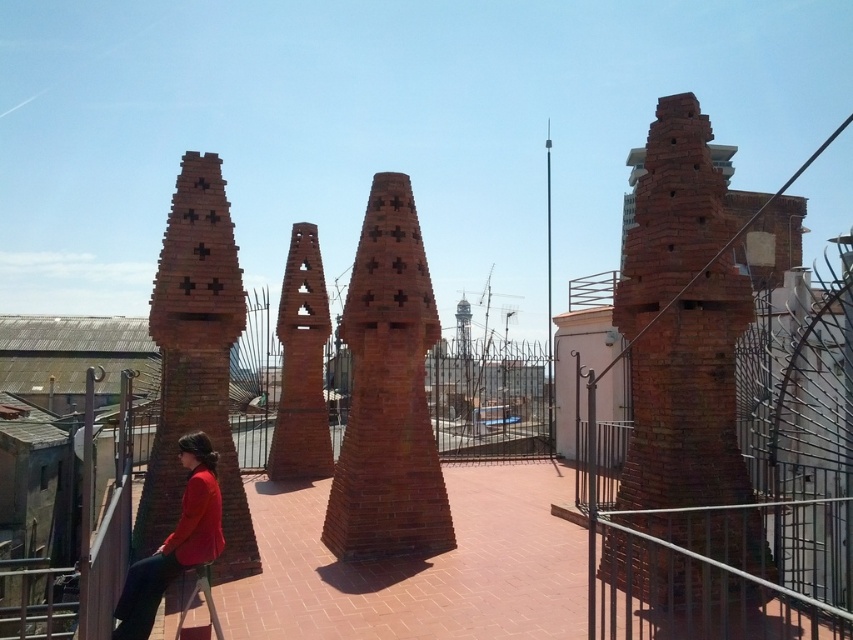
Question: Estimate the real-world distances between objects in this image. Which object is closer to the red brick chimney at center?

Choices:
 (A) red brick chimney at left
 (B) matte red jacket at lower left
 (C) red brick chimney at right
 (D) brick sculpture at center

Answer: (D)

Question: Which of the following is the farthest from the observer?

Choices:
 (A) (311, 376)
 (B) (223, 225)

Answer: (A)

Question: Is red brick chimney at right closer to the viewer compared to matte red jacket at lower left?

Choices:
 (A) yes
 (B) no

Answer: (A)

Question: Which of these objects is positioned closest to the red brick chimney at right?

Choices:
 (A) matte red jacket at lower left
 (B) red brick chimney at left

Answer: (A)

Question: Is brick sculpture at center positioned at the back of matte red jacket at lower left?

Choices:
 (A) no
 (B) yes

Answer: (B)

Question: Does red brick chimney at right appear under matte red jacket at lower left?

Choices:
 (A) yes
 (B) no

Answer: (B)